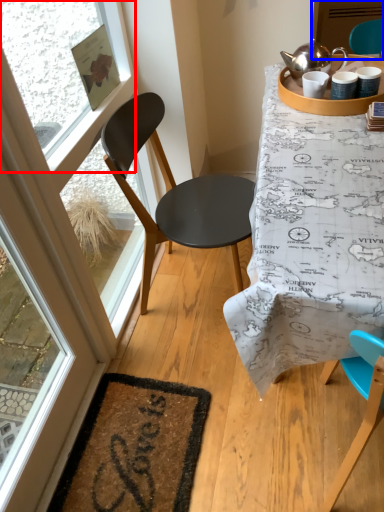
Question: Among these objects, which one is farthest to the camera, window screen (highlighted by a red box) or screen door (highlighted by a blue box)?

Choices:
 (A) window screen
 (B) screen door

Answer: (B)